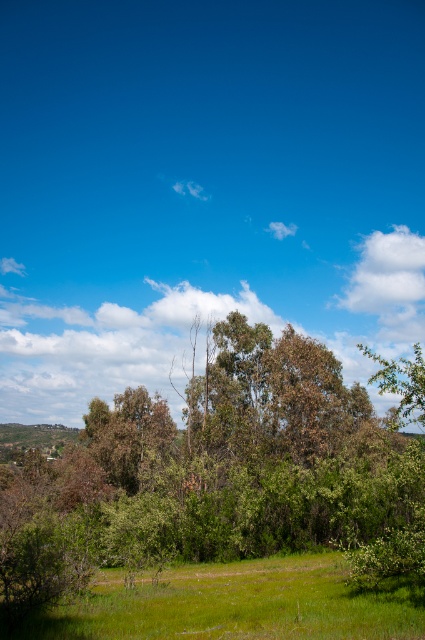
Who is lower down, green grass at lower center or white fluffy cloud at upper right?

Positioned lower is green grass at lower center.

Between green grass at lower center and white fluffy cloud at upper right, which one has more height?

Standing taller between the two is white fluffy cloud at upper right.

Find the location of a particular element. This screenshot has width=425, height=640. green grass at lower center is located at coordinates pos(234,604).

Locate an element on the screen. green grass at lower center is located at coordinates (234, 604).

Does green leafy tree at center appear over green grass at lower center?

Yes.

I want to click on green leafy tree at center, so click(221, 474).

Can you confirm if green leafy tree at center is smaller than white fluffy cloud at upper right?

Incorrect, green leafy tree at center is not smaller in size than white fluffy cloud at upper right.

You are a GUI agent. You are given a task and a screenshot of the screen. Output one action in this format:
    pyautogui.click(x=<x>, y=<y>)
    Task: Click on the green leafy tree at center
    The image size is (425, 640).
    Given the screenshot: What is the action you would take?
    pyautogui.click(x=221, y=474)